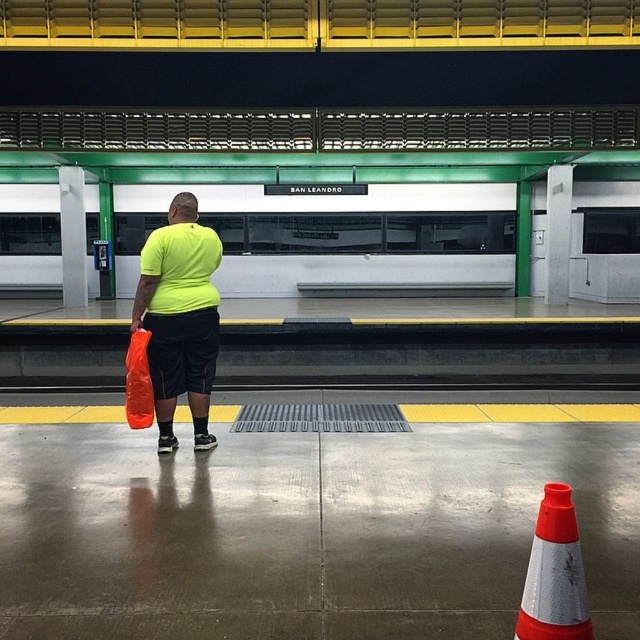
Does neon yellow t-shirt at center have a larger size compared to orange matte shopping bag at lower left?

Correct, neon yellow t-shirt at center is larger in size than orange matte shopping bag at lower left.

Is neon yellow t-shirt at center above orange matte shopping bag at lower left?

Indeed, neon yellow t-shirt at center is positioned over orange matte shopping bag at lower left.

Identify the location of neon yellow t-shirt at center. (179, 317).

Does green matte subway at center appear over neon yellow t-shirt at center?

Correct, green matte subway at center is located above neon yellow t-shirt at center.

Is green matte subway at center thinner than neon yellow t-shirt at center?

No, green matte subway at center is not thinner than neon yellow t-shirt at center.

Where is `green matte subway at center`? This screenshot has width=640, height=640. green matte subway at center is located at coordinates (353, 241).

Is green matte subway at center wider than orange reflective cone at lower right?

Indeed, green matte subway at center has a greater width compared to orange reflective cone at lower right.

Is green matte subway at center to the left of orange reflective cone at lower right from the viewer's perspective?

Yes, green matte subway at center is to the left of orange reflective cone at lower right.

This screenshot has height=640, width=640. What do you see at coordinates (353, 241) in the screenshot? I see `green matte subway at center` at bounding box center [353, 241].

You are a GUI agent. You are given a task and a screenshot of the screen. Output one action in this format:
    pyautogui.click(x=<x>, y=<y>)
    Task: Click on the green matte subway at center
    This screenshot has height=640, width=640.
    Given the screenshot: What is the action you would take?
    pyautogui.click(x=353, y=241)